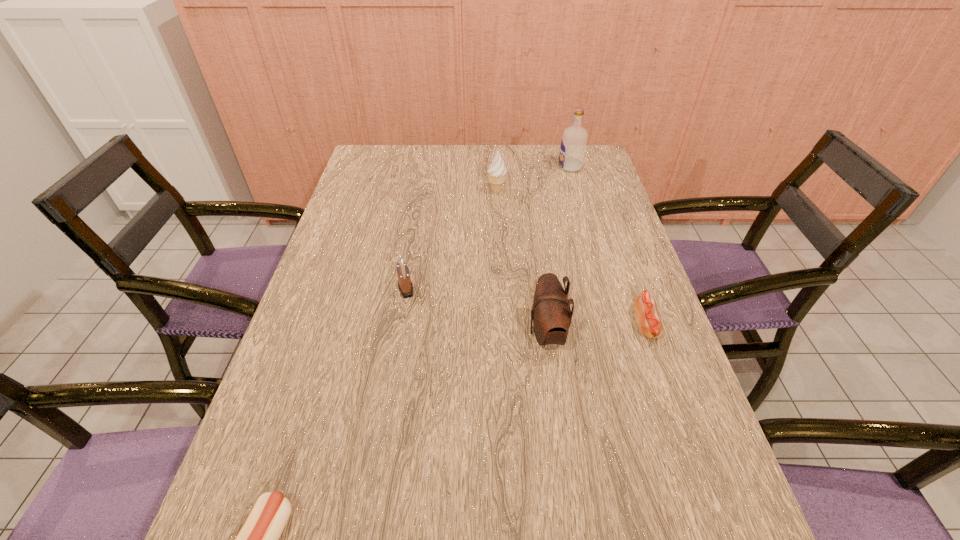
Image resolution: width=960 pixels, height=540 pixels. Find the location of `free space located on the label of the vodka`. free space located on the label of the vodka is located at coordinates (483, 167).

Locate an element on the screen. Image resolution: width=960 pixels, height=540 pixels. free region located 0.270m on the label of the vodka is located at coordinates (483, 167).

The width and height of the screenshot is (960, 540). I want to click on free region located on the front-facing side of the fourth object from right to left, so click(x=391, y=192).

Image resolution: width=960 pixels, height=540 pixels. I want to click on free space located on the front-facing side of the fourth object from right to left, so click(x=375, y=192).

I want to click on vacant space situated on the front-facing side of the fourth object from right to left, so (370, 192).

Locate an element on the screen. free space located with the flap open on the pouch is located at coordinates (421, 333).

This screenshot has height=540, width=960. Find the location of `vacant space located 0.110m with the flap open on the pouch`. vacant space located 0.110m with the flap open on the pouch is located at coordinates (482, 333).

Find the location of a particular element. This screenshot has height=540, width=960. free location located 0.370m with the flap open on the pouch is located at coordinates (371, 333).

Image resolution: width=960 pixels, height=540 pixels. I want to click on free space located on the left of the fourth nearest object, so click(x=340, y=289).

The height and width of the screenshot is (540, 960). What are the coordinates of `free point located on the front of the right sausage` in the screenshot? It's located at (683, 430).